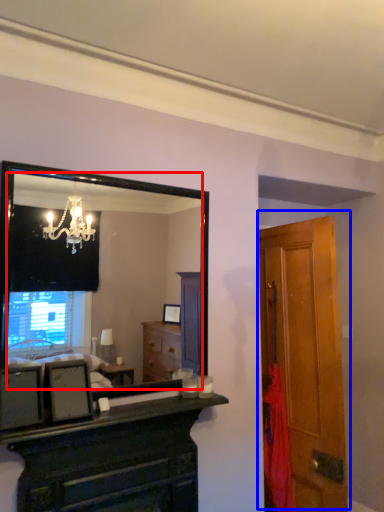
Question: Which object appears closest to the camera in this image, mirror (highlighted by a red box) or door (highlighted by a blue box)?

Choices:
 (A) mirror
 (B) door

Answer: (A)